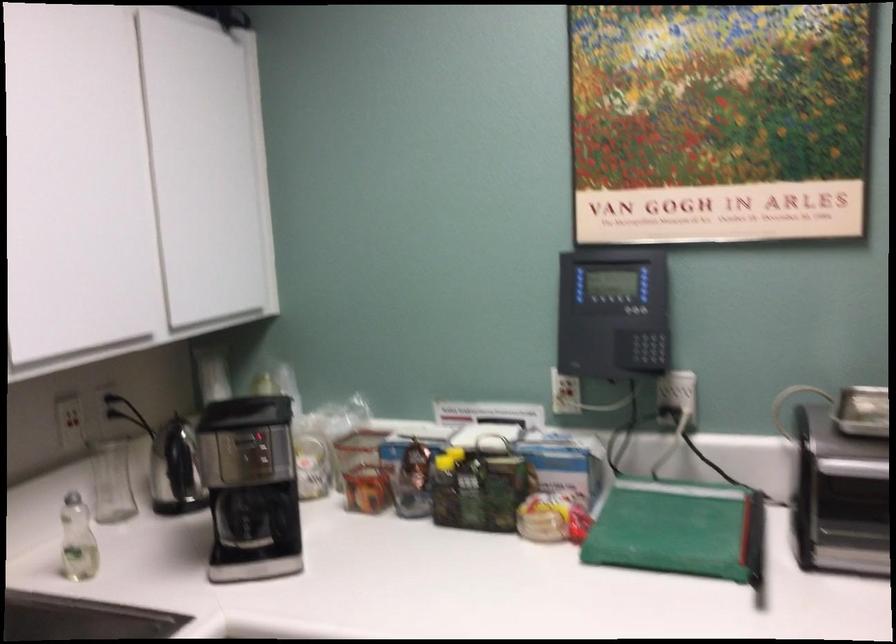
Locate an element on the screen. bottle pump top is located at coordinates (76, 540).